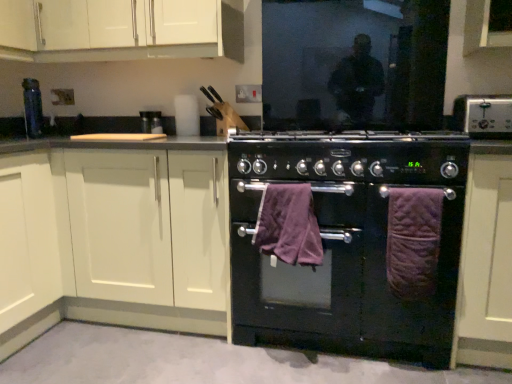
Question: Can you confirm if purple plush bath towel at center, which appears as the 1th bath towel when viewed from the left, is bigger than white matte cabinet at upper left, arranged as the 2th cabinetry when viewed from the left?

Choices:
 (A) yes
 (B) no

Answer: (B)

Question: From the image's perspective, is purple plush bath towel at center, which appears as the second bath towel when viewed from the right, located beneath white matte cabinet at upper left, arranged as the 2th cabinetry when viewed from the right?

Choices:
 (A) yes
 (B) no

Answer: (A)

Question: From a real-world perspective, is purple plush bath towel at center, which appears as the second bath towel when viewed from the right, over white matte cabinet at upper left, arranged as the 2th cabinetry when viewed from the left?

Choices:
 (A) yes
 (B) no

Answer: (B)

Question: Is purple plush bath towel at center, which appears as the second bath towel when viewed from the right, looking in the opposite direction of white matte cabinet at upper left, arranged as the 2th cabinetry when viewed from the left?

Choices:
 (A) no
 (B) yes

Answer: (A)

Question: Does purple plush bath towel at center, which appears as the second bath towel when viewed from the right, come in front of white matte cabinet at upper left, arranged as the 2th cabinetry when viewed from the right?

Choices:
 (A) yes
 (B) no

Answer: (A)

Question: In terms of size, does white matte cabinet at upper left, arranged as the 2th cabinetry when viewed from the left, appear bigger or smaller than purple plush bath towel at center, which appears as the second bath towel when viewed from the right?

Choices:
 (A) small
 (B) big

Answer: (B)

Question: From a real-world perspective, is white matte cabinet at upper left, arranged as the 2th cabinetry when viewed from the left, above or below purple plush bath towel at center, which appears as the 1th bath towel when viewed from the left?

Choices:
 (A) above
 (B) below

Answer: (A)

Question: Would you say white matte cabinet at upper left, arranged as the 2th cabinetry when viewed from the right, is inside or outside purple plush bath towel at center, which appears as the 1th bath towel when viewed from the left?

Choices:
 (A) inside
 (B) outside

Answer: (B)

Question: Is white matte cabinet at upper left, arranged as the 2th cabinetry when viewed from the left, taller or shorter than purple plush bath towel at center, which appears as the second bath towel when viewed from the right?

Choices:
 (A) tall
 (B) short

Answer: (A)

Question: From a real-world perspective, is black matte oven at center, the first appliance positioned from the front, above or below black matte oven at center?

Choices:
 (A) below
 (B) above

Answer: (B)

Question: Looking at their shapes, would you say black matte oven at center, the first appliance viewed from the right, is wider or thinner than black matte oven at center?

Choices:
 (A) wide
 (B) thin

Answer: (B)

Question: Is point coord(302,168) closer or farther from the camera than point coord(330,155)?

Choices:
 (A) closer
 (B) farther

Answer: (B)

Question: Considering the relative positions of black matte oven at center, which is the first appliance from bottom to top, and black matte oven at center in the image provided, is black matte oven at center, which is the first appliance from bottom to top, to the left or to the right of black matte oven at center?

Choices:
 (A) left
 (B) right

Answer: (B)

Question: Looking at their shapes, would you say white matte cabinet at upper left, arranged as the 2th cabinetry when viewed from the right, is wider or thinner than matte black knife block at upper center, the 1th appliance when ordered from back to front?

Choices:
 (A) wide
 (B) thin

Answer: (A)

Question: From a real-world perspective, relative to matte black knife block at upper center, acting as the second appliance starting from the front, is white matte cabinet at upper left, arranged as the 2th cabinetry when viewed from the right, vertically above or below?

Choices:
 (A) below
 (B) above

Answer: (B)